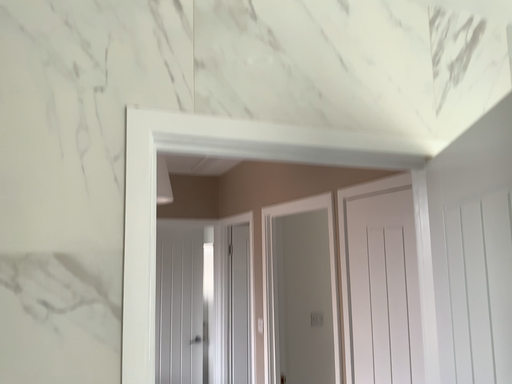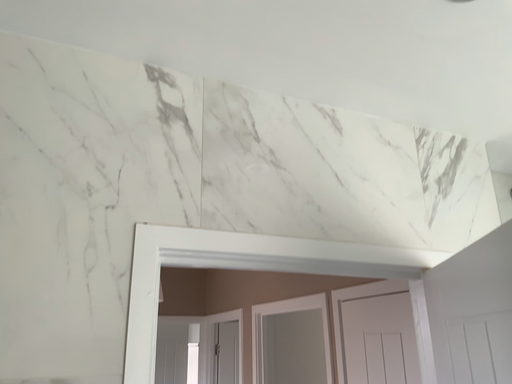
Question: How did the camera likely rotate when shooting the video?

Choices:
 (A) rotated downward
 (B) rotated upward

Answer: (B)